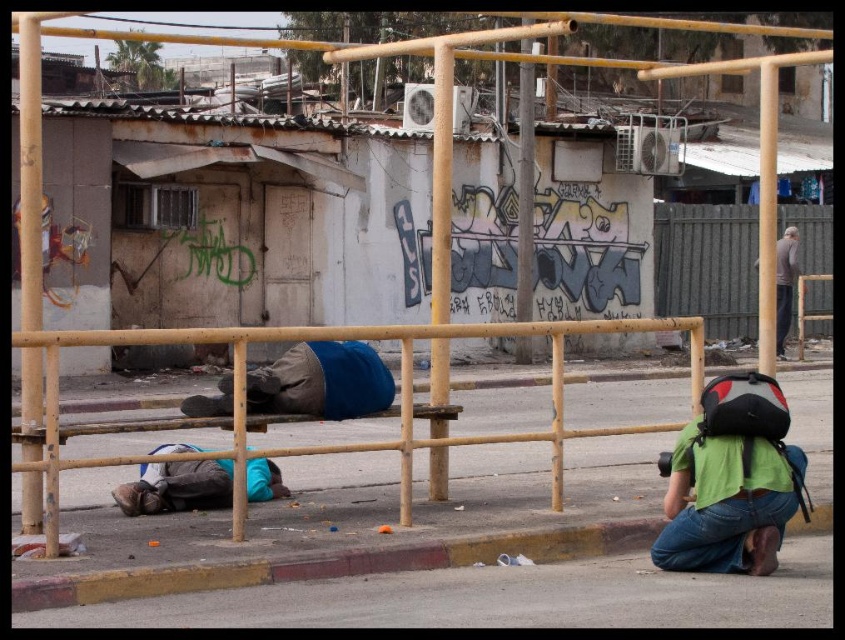
Is blue fabric at center closer to the viewer compared to blue fabric blanket at lower center?

That is True.

Who is positioned more to the left, blue fabric at center or blue fabric blanket at lower center?

blue fabric blanket at lower center is more to the left.

Locate an element on the screen. blue fabric at center is located at coordinates (320, 381).

Which is above, green fabric backpack at lower right or gray fabric pants at right?

gray fabric pants at right

Which of these two, green fabric backpack at lower right or gray fabric pants at right, stands taller?

Standing taller between the two is gray fabric pants at right.

Is point (707, 502) behind point (777, 262)?

No, (707, 502) is in front of (777, 262).

Identify the location of green fabric backpack at lower right. pos(732,481).

Which is more to the left, gray wooden fence at right or gray fabric pants at right?

From the viewer's perspective, gray fabric pants at right appears more on the left side.

What do you see at coordinates (707, 266) in the screenshot? I see `gray wooden fence at right` at bounding box center [707, 266].

Between point (813, 332) and point (781, 296), which one is positioned in front?

Point (781, 296) is more forward.

Image resolution: width=845 pixels, height=640 pixels. Find the location of `gray wooden fence at right`. gray wooden fence at right is located at coordinates (707, 266).